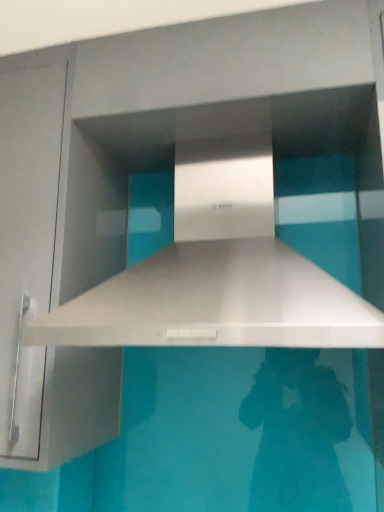
In order to click on free spot above white glossy vent at center (from a real-world perspective) in this screenshot , I will do `click(233, 120)`.